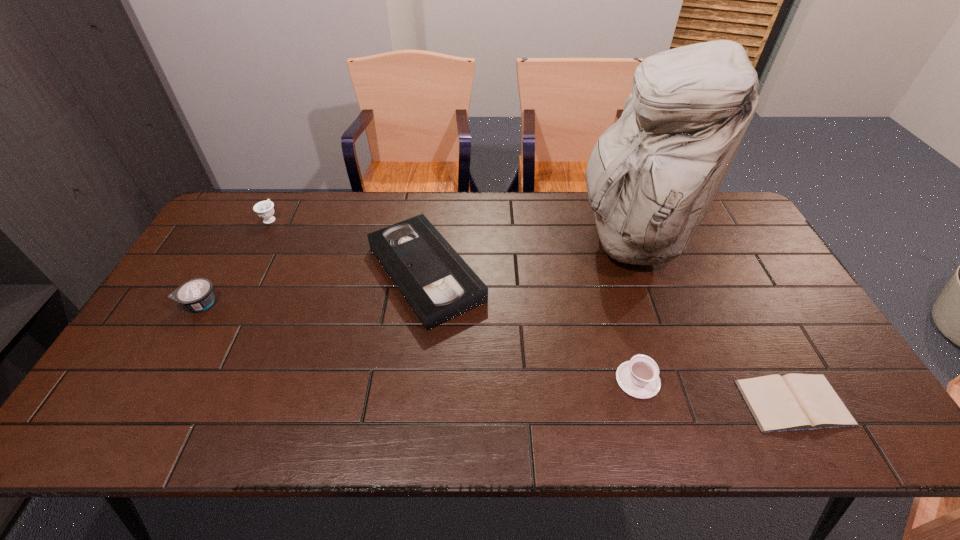
Locate an element on the screen. This screenshot has width=960, height=540. yogurt present at the left edge is located at coordinates (197, 294).

Locate an element on the screen. object at the right edge is located at coordinates (791, 402).

Image resolution: width=960 pixels, height=540 pixels. I want to click on object positioned at the far left corner, so click(264, 209).

Find the location of a particular element. This screenshot has height=540, width=960. object that is positioned at the near right corner is located at coordinates (791, 402).

This screenshot has width=960, height=540. Find the location of `vacant space at the far edge`. vacant space at the far edge is located at coordinates (519, 224).

Locate an element on the screen. free space at the near edge of the desktop is located at coordinates (421, 407).

Where is `free space at the left edge`? Image resolution: width=960 pixels, height=540 pixels. free space at the left edge is located at coordinates (139, 364).

Where is `vacant space at the right edge of the desktop`? The height and width of the screenshot is (540, 960). vacant space at the right edge of the desktop is located at coordinates (754, 294).

Locate an element on the screen. free point at the far left corner is located at coordinates (277, 197).

The width and height of the screenshot is (960, 540). Identify the location of vacant space at the far right corner of the desktop. (720, 222).